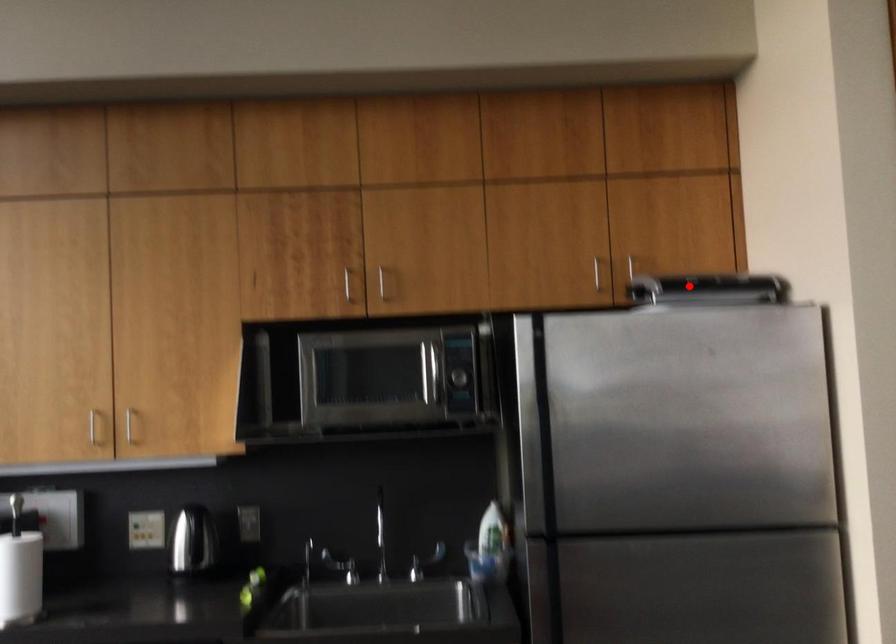
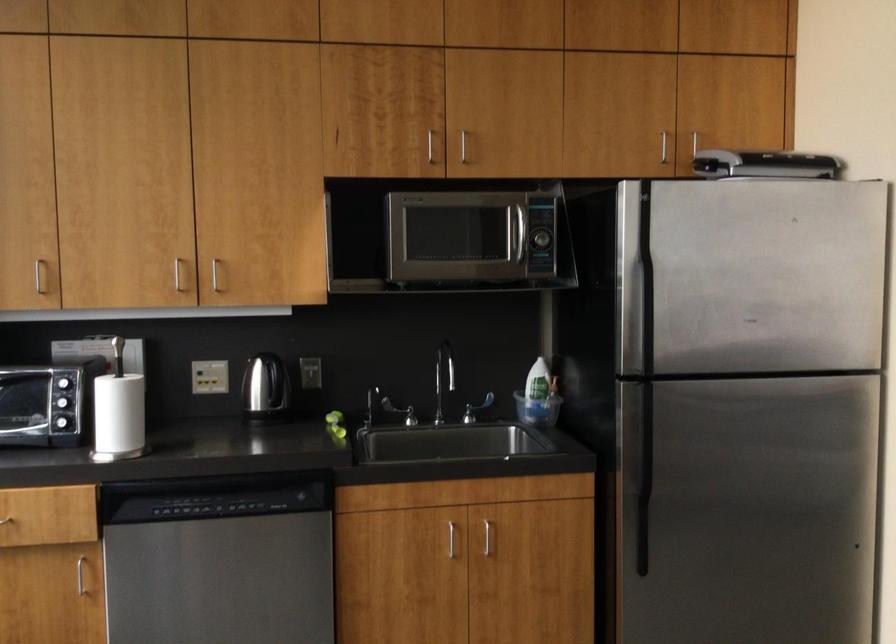
Find the pixel in the second image that matches the highlighted location in the first image.

(764, 164)